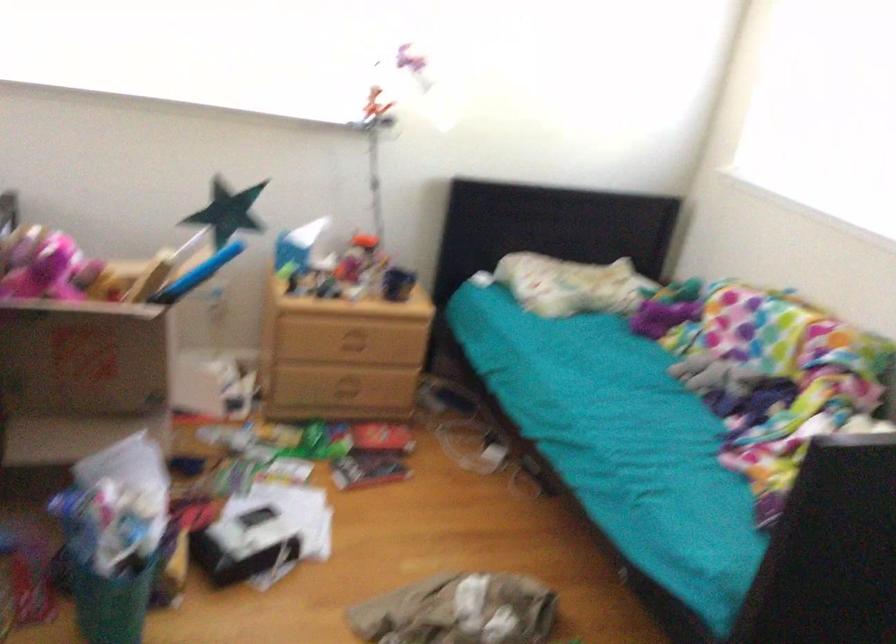
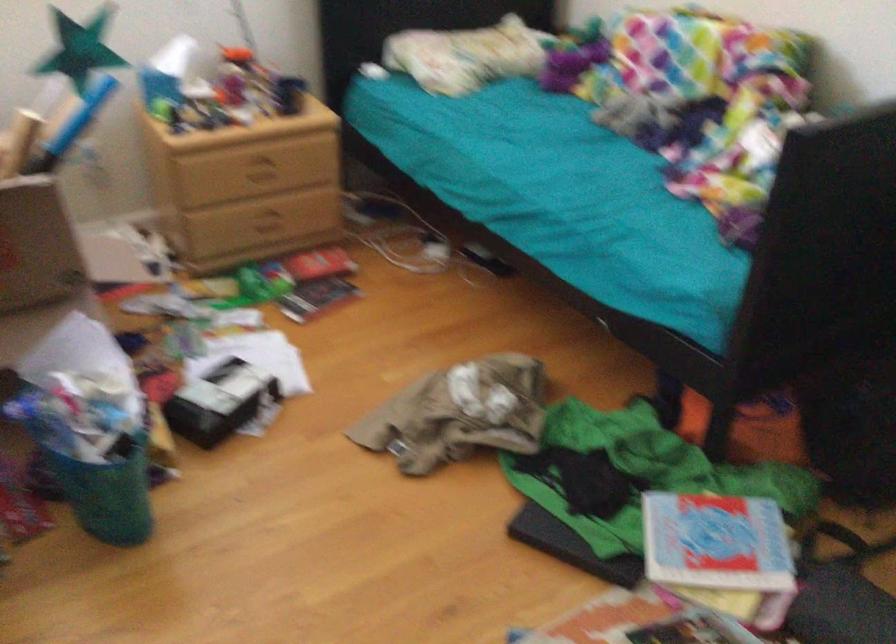
Locate, in the second image, the point that corresponds to point 132,365 in the first image.

(36, 245)